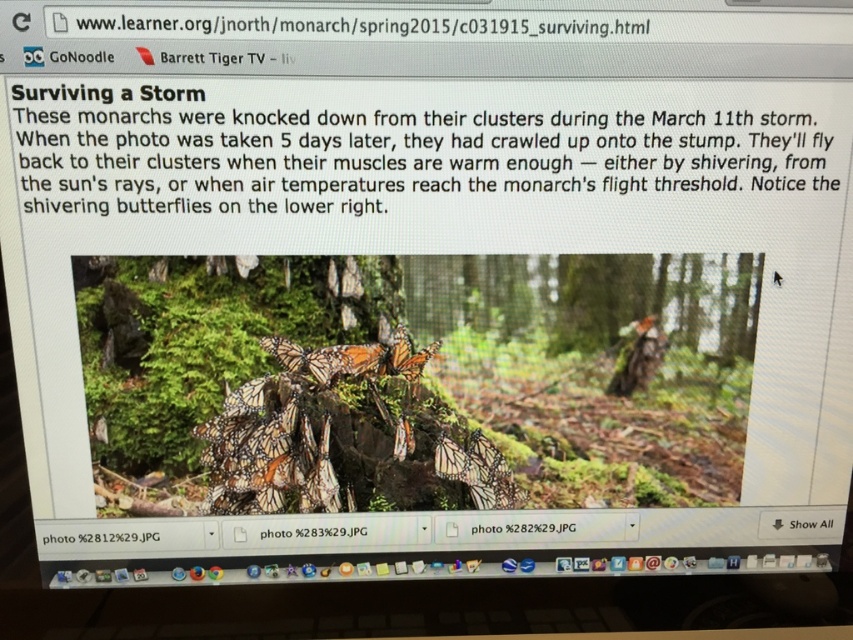
You are a biologist observing the monarch butterflies on the mossy tree stump. You notice two orange features at the center of the photo. Which one is the smaller object between the matte orange butterfly at center and the translucent orange wings at center?

The matte orange butterfly at center is smaller than the translucent orange wings at center.

You are a researcher analyzing the photo of the monarch butterflies. You need to locate the matte orange butterfly at center. What are its coordinates?

The matte orange butterfly at center is located at coordinates point (312, 531).

You are a biologist observing the monarch butterflies in the image. You notice the matte orange butterfly at center and the translucent orange wings at center. Which object is wider?

The matte orange butterfly at center is wider than the translucent orange wings at center.